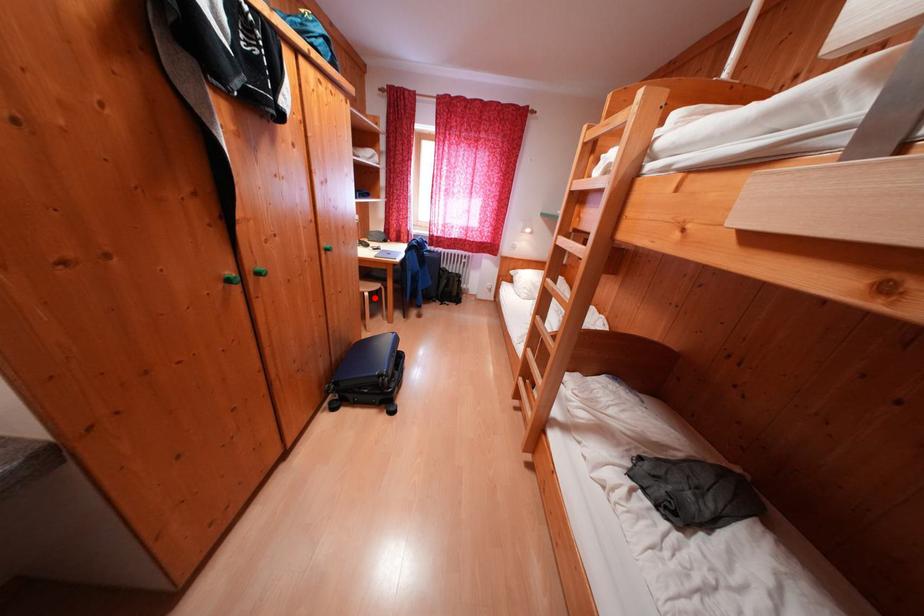
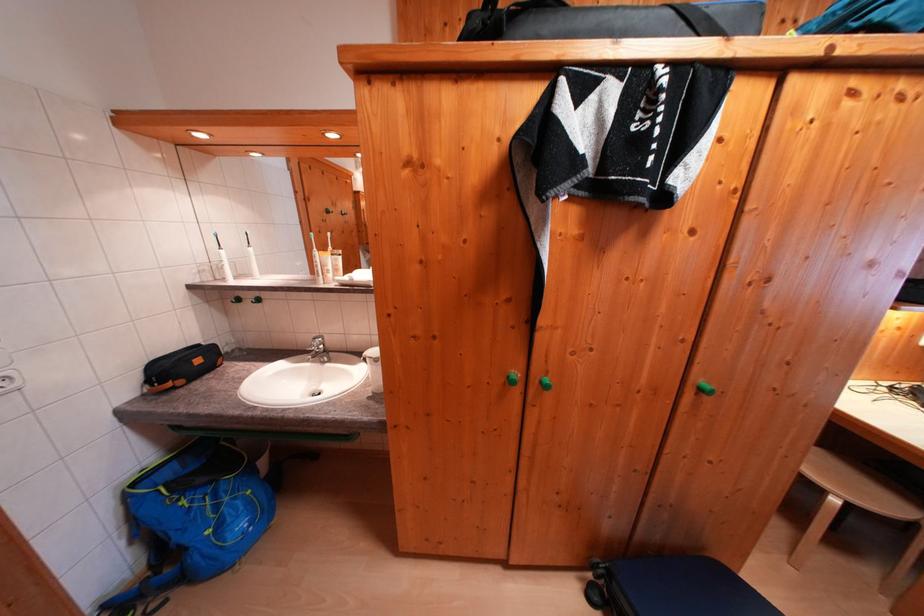
Question: I am providing you with two images of the same scene from different viewpoints. In image1, a red point is highlighted. Considering the same 3D point in image2, which of the following is correct?

Choices:
 (A) It is closer
 (B) It is farther

Answer: (A)